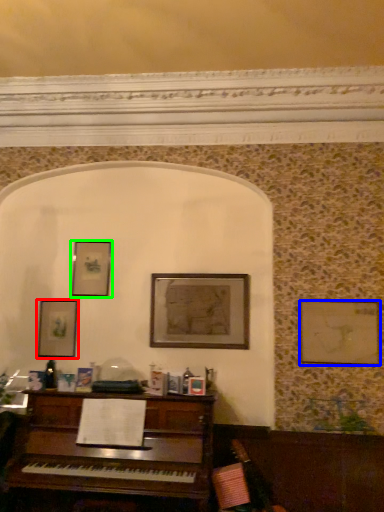
Question: Which object is the farthest from picture frame (highlighted by a red box)? Choose among these: picture frame (highlighted by a blue box) or picture frame (highlighted by a green box).

Choices:
 (A) picture frame
 (B) picture frame

Answer: (A)